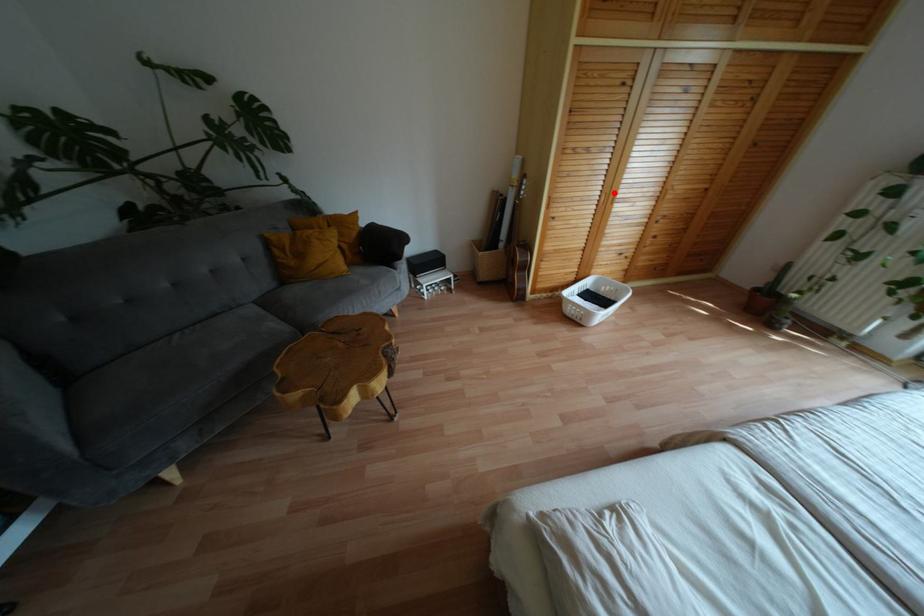
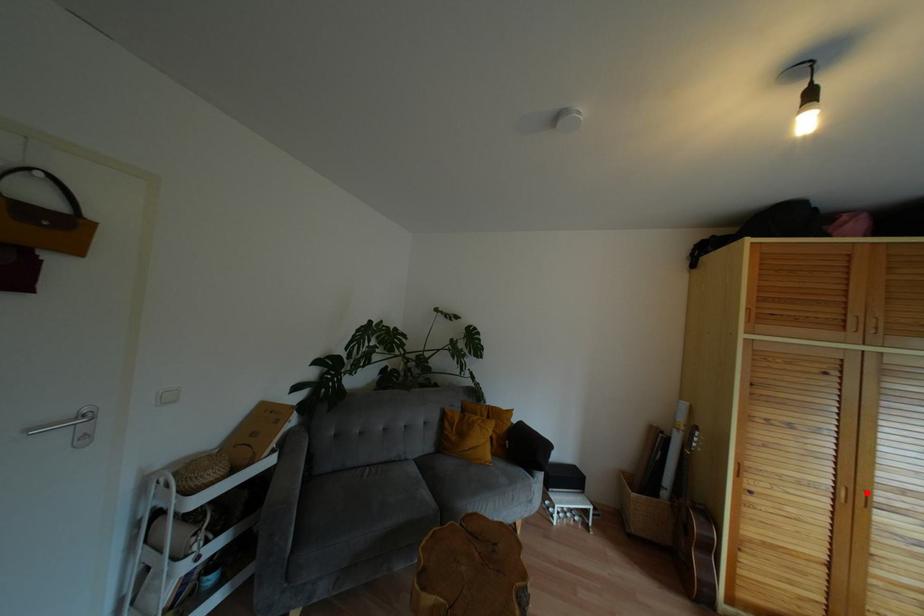
I am providing you with two images of the same scene from different viewpoints. A red point is marked on the first image and another point is marked on the second image. Are the points marked in image1 and image2 representing the same 3D position?

Yes